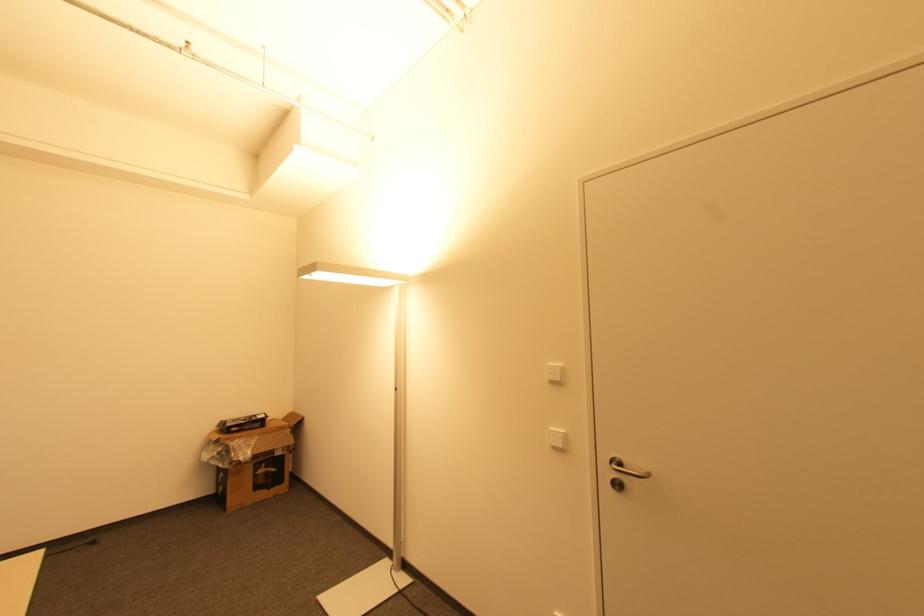
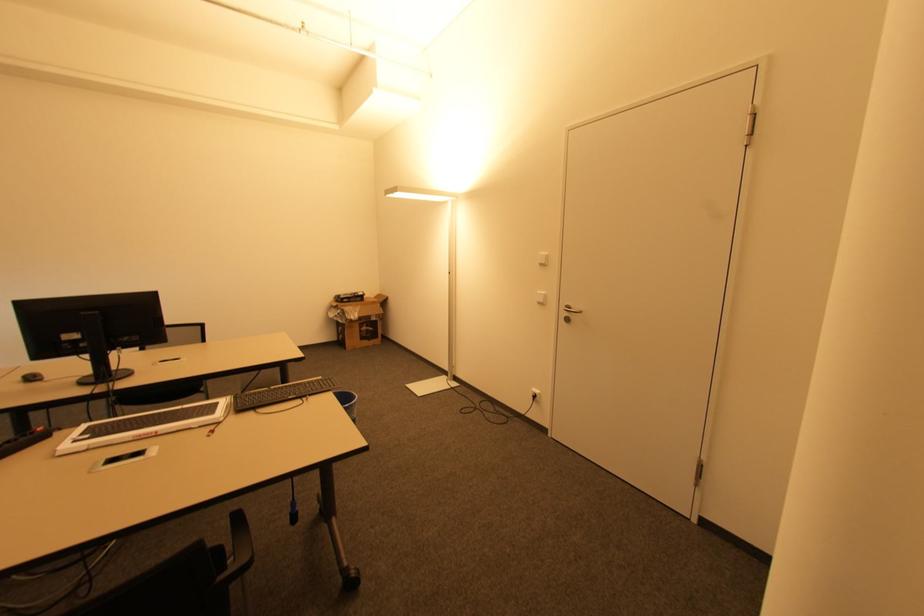
Where in the second image is the point corresponding to point (554, 383) from the first image?

(542, 265)